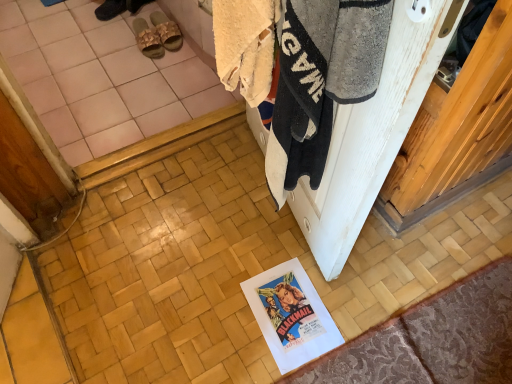
Find the location of a particular element. vacant space in front of white wood screen door at upper right is located at coordinates (292, 296).